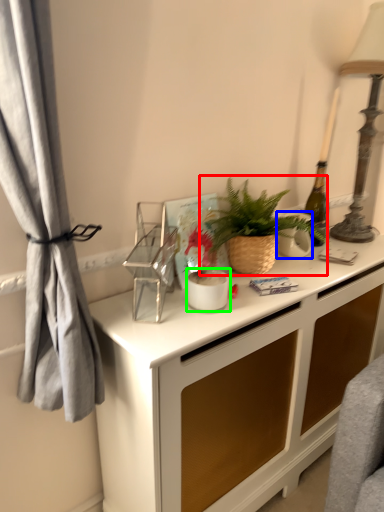
Question: Based on their relative distances, which object is farther from houseplant (highlighted by a red box)? Choose from appliance (highlighted by a blue box) and appliance (highlighted by a green box).

Choices:
 (A) appliance
 (B) appliance

Answer: (B)